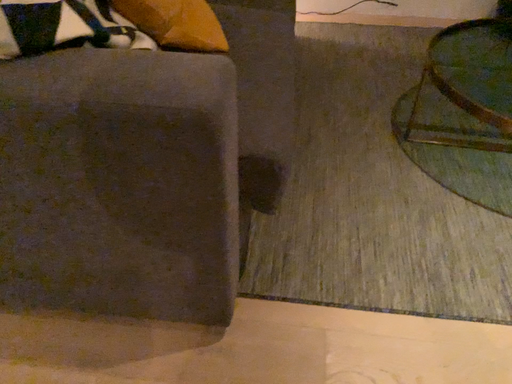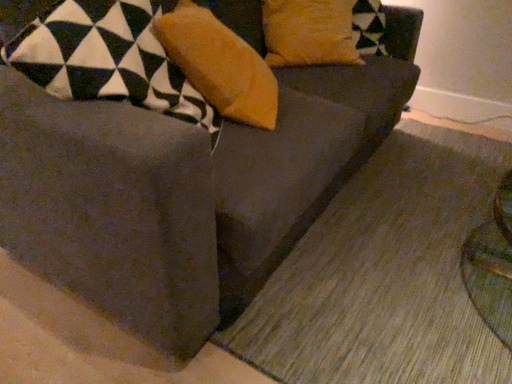
Question: How did the camera likely rotate when shooting the video?

Choices:
 (A) rotated downward
 (B) rotated upward

Answer: (B)